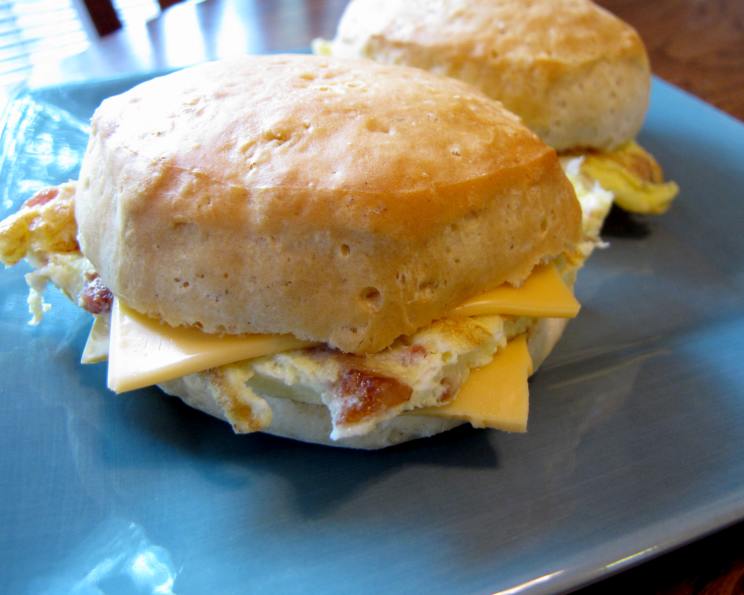
Locate an element on the screen. table is located at coordinates (711, 62).